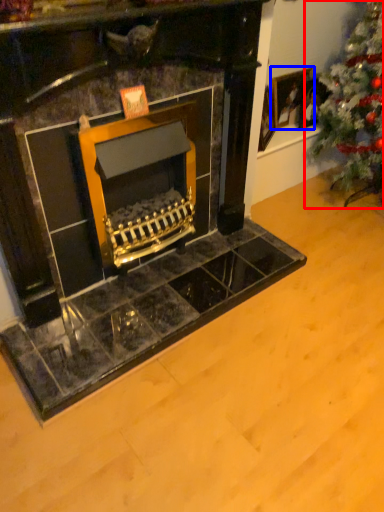
Question: Which of the following is the farthest to the observer, christmas tree (highlighted by a red box) or picture frame (highlighted by a blue box)?

Choices:
 (A) christmas tree
 (B) picture frame

Answer: (B)